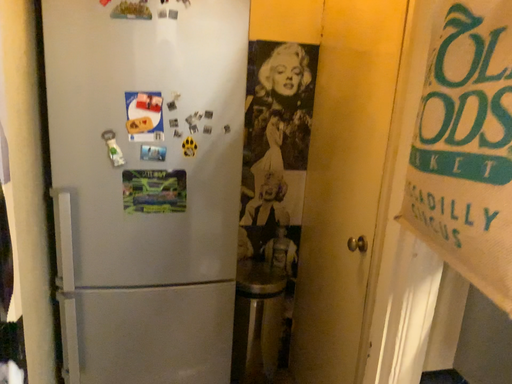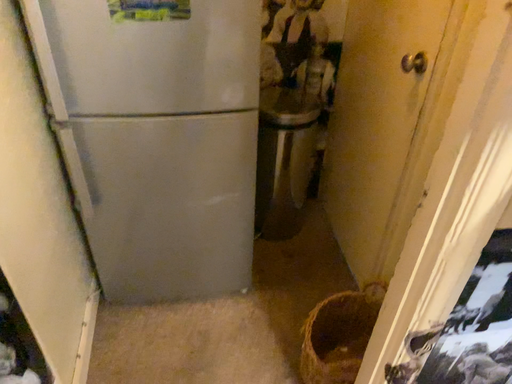
Question: How did the camera likely rotate when shooting the video?

Choices:
 (A) rotated downward
 (B) rotated upward

Answer: (A)